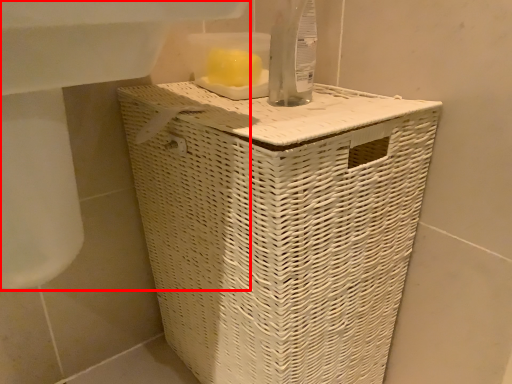
Question: From the image's perspective, what is the correct spatial relationship of sink (annotated by the red box) in relation to waste container?

Choices:
 (A) above
 (B) below

Answer: (A)